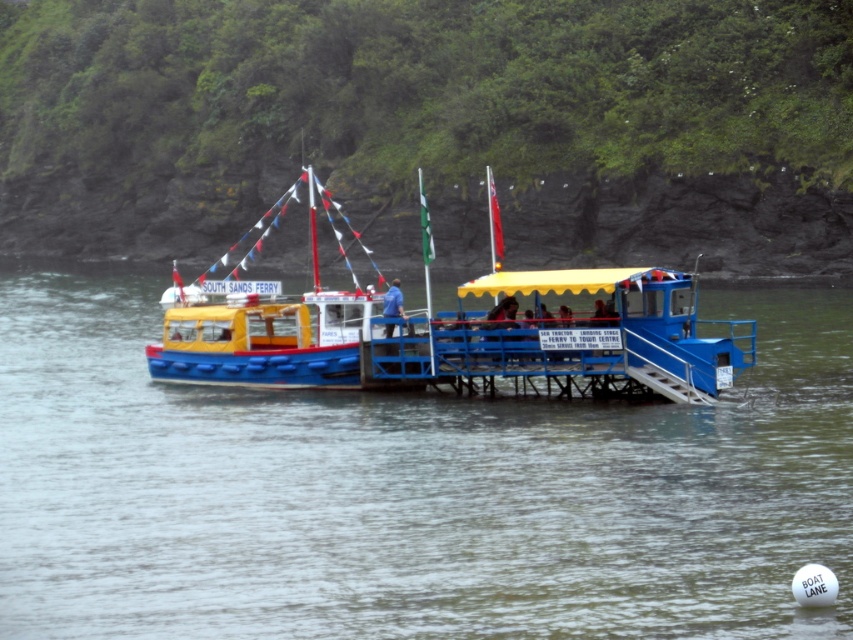
Question: Is transparent water at center to the left of yellow matte ferry at center from the viewer's perspective?

Choices:
 (A) yes
 (B) no

Answer: (B)

Question: Does transparent water at center have a greater width compared to yellow matte ferry at center?

Choices:
 (A) no
 (B) yes

Answer: (B)

Question: Which point is farther to the camera?

Choices:
 (A) transparent water at center
 (B) yellow matte ferry at center

Answer: (B)

Question: Where is transparent water at center located in relation to yellow matte ferry at center in the image?

Choices:
 (A) right
 (B) left

Answer: (A)

Question: Which point is closer to the camera taking this photo?

Choices:
 (A) (134, 552)
 (B) (309, 310)

Answer: (A)

Question: Which of the following is the farthest from the observer?

Choices:
 (A) (192, 380)
 (B) (12, 408)

Answer: (A)